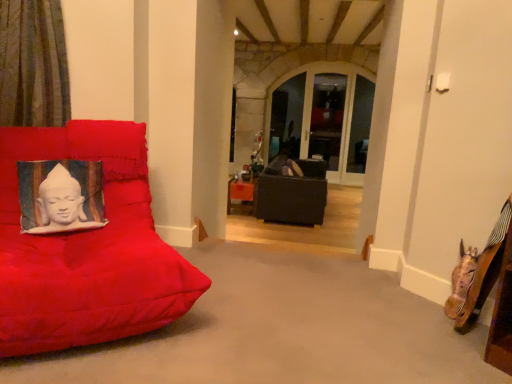
This screenshot has height=384, width=512. In order to click on clear glass window at center in this screenshot , I will do `click(323, 118)`.

The height and width of the screenshot is (384, 512). Describe the element at coordinates (292, 193) in the screenshot. I see `matte black couch at center, acting as the 2th furniture starting from the front` at that location.

What do you see at coordinates (60, 196) in the screenshot? I see `silk cushion with buddha print at left` at bounding box center [60, 196].

This screenshot has height=384, width=512. What do you see at coordinates (33, 64) in the screenshot? I see `green striped curtain at left` at bounding box center [33, 64].

The image size is (512, 384). I want to click on suede red cushion at left, acting as the 2th furniture starting from the right, so click(87, 249).

Looking at this image, considering the positions of objects matte black couch at center, marked as the 2th furniture in a left-to-right arrangement, and silk cushion with buddha print at left in the image provided, who is in front, matte black couch at center, marked as the 2th furniture in a left-to-right arrangement, or silk cushion with buddha print at left?

silk cushion with buddha print at left is more forward.

From the picture: Which object is positioned more to the right, matte black couch at center, placed as the first furniture when sorted from back to front, or silk cushion with buddha print at left?

matte black couch at center, placed as the first furniture when sorted from back to front.

Who is smaller, matte black couch at center, marked as the 2th furniture in a left-to-right arrangement, or silk cushion with buddha print at left?

Smaller between the two is silk cushion with buddha print at left.

Between point (320, 184) and point (65, 184), which one is positioned behind?

Positioned behind is point (320, 184).

Identify the location of furniture that appears on the left of matte black couch at center, placed as the first furniture when sorted from back to front. The image size is (512, 384). (87, 249).

Is matte black couch at center, placed as the first furniture when sorted from back to front, bigger or smaller than suede red cushion at left, which appears as the first furniture when viewed from the left?

matte black couch at center, placed as the first furniture when sorted from back to front, is bigger than suede red cushion at left, which appears as the first furniture when viewed from the left.

Which is in front, point (297, 193) or point (20, 313)?

Positioned in front is point (20, 313).

In the scene shown: Is matte black couch at center, marked as the 2th furniture in a left-to-right arrangement, thinner than suede red cushion at left, the 2th furniture positioned from the back?

Indeed, matte black couch at center, marked as the 2th furniture in a left-to-right arrangement, has a lesser width compared to suede red cushion at left, the 2th furniture positioned from the back.

Does green striped curtain at left touch matte black couch at center, acting as the 2th furniture starting from the front?

No, green striped curtain at left is not with matte black couch at center, acting as the 2th furniture starting from the front.

How far apart are green striped curtain at left and matte black couch at center, which is the first furniture from right to left?

A distance of 7.56 feet exists between green striped curtain at left and matte black couch at center, which is the first furniture from right to left.

Between green striped curtain at left and matte black couch at center, placed as the first furniture when sorted from back to front, which one has smaller width?

Thinner between the two is green striped curtain at left.

Is green striped curtain at left bigger or smaller than matte black couch at center, which is the first furniture from right to left?

In the image, green striped curtain at left appears to be smaller than matte black couch at center, which is the first furniture from right to left.

Between silk cushion with buddha print at left and clear glass window at center, which one appears on the left side from the viewer's perspective?

From the viewer's perspective, silk cushion with buddha print at left appears more on the left side.

From a real-world perspective, which is physically above, silk cushion with buddha print at left or clear glass window at center?

From a 3D spatial view, clear glass window at center is above.

Considering the sizes of silk cushion with buddha print at left and clear glass window at center in the image, is silk cushion with buddha print at left taller or shorter than clear glass window at center?

In the image, silk cushion with buddha print at left appears to be shorter than clear glass window at center.

In terms of width, does silk cushion with buddha print at left look wider or thinner when compared to clear glass window at center?

Clearly, silk cushion with buddha print at left has more width compared to clear glass window at center.

Does point (129, 275) come farther from viewer compared to point (25, 192)?

No, (129, 275) is in front of (25, 192).

From the image's perspective, is suede red cushion at left, arranged as the first furniture when viewed from the front, under silk cushion with buddha print at left?

Yes, from the image's perspective, suede red cushion at left, arranged as the first furniture when viewed from the front, is beneath silk cushion with buddha print at left.

Looking at this image, considering the positions of objects suede red cushion at left, which appears as the first furniture when viewed from the left, and silk cushion with buddha print at left in the image provided, who is in front, suede red cushion at left, which appears as the first furniture when viewed from the left, or silk cushion with buddha print at left?

suede red cushion at left, which appears as the first furniture when viewed from the left.

Find the location of a particular element. This screenshot has height=384, width=512. furniture located below the silk cushion with buddha print at left (from the image's perspective) is located at coordinates (87, 249).

Considering the sizes of suede red cushion at left, arranged as the first furniture when viewed from the front, and clear glass window at center in the image, is suede red cushion at left, arranged as the first furniture when viewed from the front, taller or shorter than clear glass window at center?

suede red cushion at left, arranged as the first furniture when viewed from the front, is shorter than clear glass window at center.

How many degrees apart are the facing directions of suede red cushion at left, arranged as the first furniture when viewed from the front, and clear glass window at center?

The angle between the facing direction of suede red cushion at left, arranged as the first furniture when viewed from the front, and the facing direction of clear glass window at center is 38.1 degrees.

This screenshot has height=384, width=512. Identify the location of window above the suede red cushion at left, arranged as the first furniture when viewed from the front (from the image's perspective). (323, 118).

Is silk cushion with buddha print at left positioned beyond the bounds of suede red cushion at left, the 2th furniture positioned from the back?

Result: Actually, silk cushion with buddha print at left is within suede red cushion at left, the 2th furniture positioned from the back.

Is silk cushion with buddha print at left oriented away from suede red cushion at left, acting as the 2th furniture starting from the right?

That's right, silk cushion with buddha print at left is facing away from suede red cushion at left, acting as the 2th furniture starting from the right.

Locate an element on the screen. person located above the suede red cushion at left, the 2th furniture positioned from the back (from the image's perspective) is located at coordinates (60, 196).

Is silk cushion with buddha print at left next to suede red cushion at left, which appears as the first furniture when viewed from the left?

No, silk cushion with buddha print at left is not beside suede red cushion at left, which appears as the first furniture when viewed from the left.

Where is `person lying in front of the matte black couch at center, acting as the 2th furniture starting from the front`? This screenshot has height=384, width=512. person lying in front of the matte black couch at center, acting as the 2th furniture starting from the front is located at coordinates (60, 196).

Locate an element on the screen. The image size is (512, 384). furniture that appears below the suede red cushion at left, acting as the 2th furniture starting from the right (from a real-world perspective) is located at coordinates (x=292, y=193).

Based on their spatial positions, is silk cushion with buddha print at left or suede red cushion at left, acting as the 2th furniture starting from the right, closer to green striped curtain at left?

Among the two, silk cushion with buddha print at left is located nearer to green striped curtain at left.

Looking at the image, which one is located further to suede red cushion at left, arranged as the first furniture when viewed from the front, clear glass window at center or silk cushion with buddha print at left?

clear glass window at center lies further to suede red cushion at left, arranged as the first furniture when viewed from the front, than the other object.

Estimate the real-world distances between objects in this image. Which object is further from silk cushion with buddha print at left, green striped curtain at left or suede red cushion at left, the 2th furniture positioned from the back?

Based on the image, green striped curtain at left appears to be further to silk cushion with buddha print at left.

Estimate the real-world distances between objects in this image. Which object is further from silk cushion with buddha print at left, suede red cushion at left, the 2th furniture positioned from the back, or matte black couch at center, acting as the 2th furniture starting from the front?

matte black couch at center, acting as the 2th furniture starting from the front, is further to silk cushion with buddha print at left.

Considering their positions, is matte black couch at center, which is the first furniture from right to left, positioned further to suede red cushion at left, acting as the 2th furniture starting from the right, than clear glass window at center?

clear glass window at center lies further to suede red cushion at left, acting as the 2th furniture starting from the right, than the other object.

Looking at the image, which one is located closer to silk cushion with buddha print at left, matte black couch at center, marked as the 2th furniture in a left-to-right arrangement, or clear glass window at center?

The object closer to silk cushion with buddha print at left is matte black couch at center, marked as the 2th furniture in a left-to-right arrangement.

Considering their positions, is green striped curtain at left positioned closer to matte black couch at center, marked as the 2th furniture in a left-to-right arrangement, than suede red cushion at left, acting as the 2th furniture starting from the right?

suede red cushion at left, acting as the 2th furniture starting from the right, lies closer to matte black couch at center, marked as the 2th furniture in a left-to-right arrangement, than the other object.

When comparing their distances from green striped curtain at left, does suede red cushion at left, which appears as the first furniture when viewed from the left, or clear glass window at center seem closer?

suede red cushion at left, which appears as the first furniture when viewed from the left, is positioned closer to the anchor green striped curtain at left.

Where is `curtain between suede red cushion at left, the 2th furniture positioned from the back, and matte black couch at center, placed as the first furniture when sorted from back to front, in the front-back direction`? curtain between suede red cushion at left, the 2th furniture positioned from the back, and matte black couch at center, placed as the first furniture when sorted from back to front, in the front-back direction is located at coordinates (33, 64).

Where is `person between green striped curtain at left and clear glass window at center along the z-axis`? person between green striped curtain at left and clear glass window at center along the z-axis is located at coordinates (60, 196).

Where is `curtain between suede red cushion at left, which appears as the first furniture when viewed from the left, and silk cushion with buddha print at left in the front-back direction`? curtain between suede red cushion at left, which appears as the first furniture when viewed from the left, and silk cushion with buddha print at left in the front-back direction is located at coordinates pos(33,64).

Locate an element on the screen. The width and height of the screenshot is (512, 384). curtain located between suede red cushion at left, which appears as the first furniture when viewed from the left, and clear glass window at center in the depth direction is located at coordinates (33, 64).